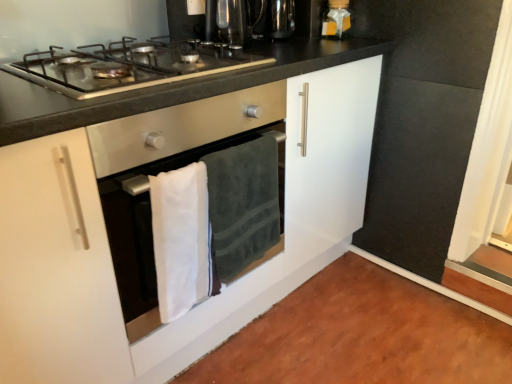
Question: Is dark green plush towel at center, the 1th bath towel in the right-to-left sequence, at the right side of white cotton bath towel at center, which ranks as the 2th bath towel in right-to-left order?

Choices:
 (A) yes
 (B) no

Answer: (A)

Question: Does dark green plush towel at center, which appears as the second bath towel when viewed from the left, come behind white cotton bath towel at center, arranged as the first bath towel when viewed from the left?

Choices:
 (A) no
 (B) yes

Answer: (B)

Question: Does dark green plush towel at center, which appears as the second bath towel when viewed from the left, have a lesser height compared to white cotton bath towel at center, which ranks as the 2th bath towel in right-to-left order?

Choices:
 (A) no
 (B) yes

Answer: (A)

Question: Is white cotton bath towel at center, arranged as the first bath towel when viewed from the left, located within dark green plush towel at center, which appears as the second bath towel when viewed from the left?

Choices:
 (A) no
 (B) yes

Answer: (A)

Question: From the image's perspective, is dark green plush towel at center, the 1th bath towel in the right-to-left sequence, located beneath white cotton bath towel at center, arranged as the first bath towel when viewed from the left?

Choices:
 (A) no
 (B) yes

Answer: (A)

Question: From a real-world perspective, is dark green plush towel at center, which appears as the second bath towel when viewed from the left, on white cotton bath towel at center, which ranks as the 2th bath towel in right-to-left order?

Choices:
 (A) no
 (B) yes

Answer: (B)

Question: Is matte gold gift box at upper right with white cotton bath towel at center, arranged as the first bath towel when viewed from the left?

Choices:
 (A) yes
 (B) no

Answer: (B)

Question: Does matte gold gift box at upper right come behind white cotton bath towel at center, arranged as the first bath towel when viewed from the left?

Choices:
 (A) yes
 (B) no

Answer: (A)

Question: Is matte gold gift box at upper right smaller than white cotton bath towel at center, which ranks as the 2th bath towel in right-to-left order?

Choices:
 (A) yes
 (B) no

Answer: (A)

Question: Considering the relative sizes of matte gold gift box at upper right and white cotton bath towel at center, which ranks as the 2th bath towel in right-to-left order, in the image provided, is matte gold gift box at upper right wider than white cotton bath towel at center, which ranks as the 2th bath towel in right-to-left order,?

Choices:
 (A) yes
 (B) no

Answer: (A)

Question: Does matte gold gift box at upper right turn towards white cotton bath towel at center, which ranks as the 2th bath towel in right-to-left order?

Choices:
 (A) no
 (B) yes

Answer: (A)

Question: Considering the relative positions of matte gold gift box at upper right and white cotton bath towel at center, arranged as the first bath towel when viewed from the left, in the image provided, is matte gold gift box at upper right to the right of white cotton bath towel at center, arranged as the first bath towel when viewed from the left, from the viewer's perspective?

Choices:
 (A) yes
 (B) no

Answer: (A)

Question: Is matte gold gift box at upper right bigger than stainless steel gas stove at upper center?

Choices:
 (A) yes
 (B) no

Answer: (B)